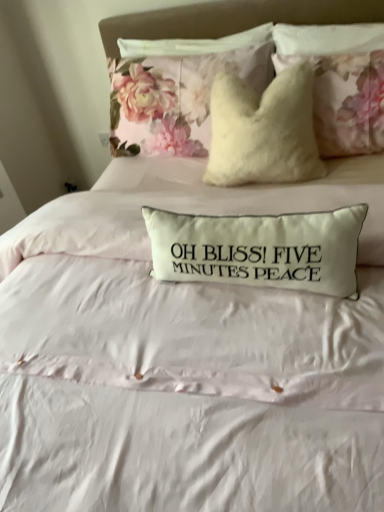
Question: From the image's perspective, is floral fabric cushion at upper center, which is the 2th pillow from bottom to top, below white fabric pillow at center, the 1th pillow viewed from the front?

Choices:
 (A) no
 (B) yes

Answer: (A)

Question: Does floral fabric cushion at upper center, which is the 1th pillow in top-to-bottom order, have a lesser width compared to white fabric pillow at center, placed as the 2th pillow when sorted from top to bottom?

Choices:
 (A) yes
 (B) no

Answer: (B)

Question: Is floral fabric cushion at upper center, which is the 1th pillow in top-to-bottom order, positioned with its back to white fabric pillow at center, acting as the 1th pillow starting from the bottom?

Choices:
 (A) yes
 (B) no

Answer: (B)

Question: Considering the relative positions of floral fabric cushion at upper center, the 2th pillow from the front, and white fabric pillow at center, acting as the 1th pillow starting from the bottom, in the image provided, is floral fabric cushion at upper center, the 2th pillow from the front, behind white fabric pillow at center, acting as the 1th pillow starting from the bottom,?

Choices:
 (A) no
 (B) yes

Answer: (B)

Question: Can you confirm if floral fabric cushion at upper center, which is the 2th pillow from bottom to top, is bigger than white fabric pillow at center, placed as the 2th pillow when sorted from top to bottom?

Choices:
 (A) yes
 (B) no

Answer: (A)

Question: From a real-world perspective, is floral fabric cushion at upper center, which is the 1th pillow in top-to-bottom order, below white fabric pillow at center, acting as the 1th pillow starting from the bottom?

Choices:
 (A) yes
 (B) no

Answer: (B)

Question: Does fluffy white pillow at upper center have a lesser height compared to white fabric pillow at center, acting as the 1th pillow starting from the bottom?

Choices:
 (A) yes
 (B) no

Answer: (B)

Question: From the image's perspective, does fluffy white pillow at upper center appear lower than white fabric pillow at center, placed as the 2th pillow when sorted from top to bottom?

Choices:
 (A) yes
 (B) no

Answer: (B)

Question: Is fluffy white pillow at upper center taller than white fabric pillow at center, marked as the 2th pillow in a back-to-front arrangement?

Choices:
 (A) yes
 (B) no

Answer: (A)

Question: Is fluffy white pillow at upper center not near white fabric pillow at center, marked as the 2th pillow in a back-to-front arrangement?

Choices:
 (A) yes
 (B) no

Answer: (A)

Question: Is fluffy white pillow at upper center thinner than white fabric pillow at center, acting as the 1th pillow starting from the bottom?

Choices:
 (A) yes
 (B) no

Answer: (B)

Question: From a real-world perspective, is fluffy white pillow at upper center located beneath white fabric pillow at center, the 1th pillow viewed from the front?

Choices:
 (A) yes
 (B) no

Answer: (B)

Question: Does white fabric pillow at center, acting as the 1th pillow starting from the bottom, have a larger size compared to fluffy white pillow at upper center?

Choices:
 (A) yes
 (B) no

Answer: (B)